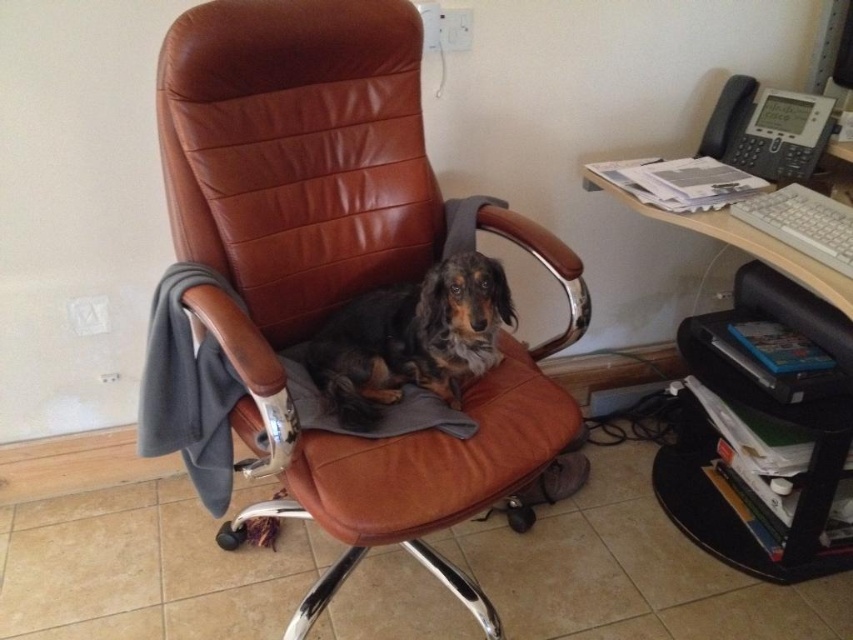
Question: Is brown leather swivel chair at center above black plastic computer desk at right?

Choices:
 (A) no
 (B) yes

Answer: (B)

Question: Which object is positioned closest to the black leather dog at center?

Choices:
 (A) brown leather swivel chair at center
 (B) black plastic computer desk at right

Answer: (A)

Question: Among these objects, which one is farthest from the camera?

Choices:
 (A) black leather dog at center
 (B) black plastic computer desk at right

Answer: (B)

Question: Is black plastic computer desk at right bigger than black leather dog at center?

Choices:
 (A) no
 (B) yes

Answer: (B)

Question: Based on their relative distances, which object is farther from the black plastic computer desk at right?

Choices:
 (A) brown leather swivel chair at center
 (B) black leather dog at center

Answer: (A)

Question: Is brown leather swivel chair at center bigger than black plastic computer desk at right?

Choices:
 (A) yes
 (B) no

Answer: (A)